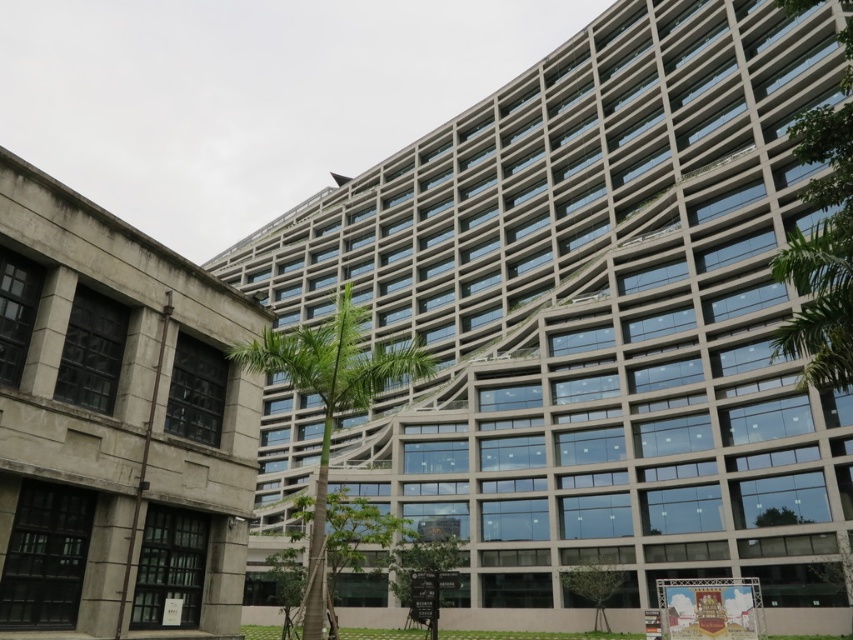
Question: Is green leafy tree at right in front of green leafy tree at lower center?

Choices:
 (A) no
 (B) yes

Answer: (B)

Question: Considering the relative positions of green leafy tree at right and green leafy palm tree at center in the image provided, where is green leafy tree at right located with respect to green leafy palm tree at center?

Choices:
 (A) left
 (B) right

Answer: (B)

Question: Is green leafy tree at right further to camera compared to green leafy palm tree at center?

Choices:
 (A) yes
 (B) no

Answer: (B)

Question: Which object is the farthest from the green leafy tree at right?

Choices:
 (A) green leafy palm tree at center
 (B) green leafy tree at lower center

Answer: (B)

Question: Which object appears farthest from the camera in this image?

Choices:
 (A) green leafy tree at right
 (B) green leafy palm tree at center
 (C) green leafy tree at lower center

Answer: (C)

Question: Which point is farther from the camera taking this photo?

Choices:
 (A) (811, 276)
 (B) (569, 572)
 (C) (345, 365)

Answer: (B)